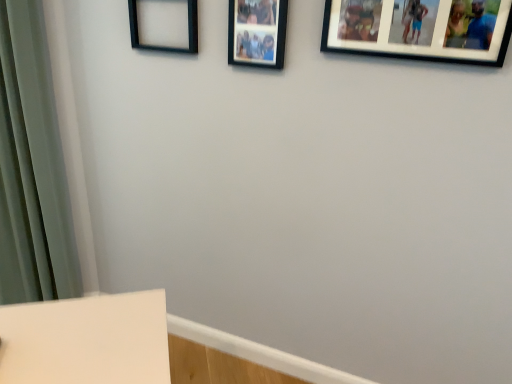
How much space does black matte picture frame at upper center, the 2th picture frame from the right, occupy horizontally?

1.53 inches.

Measure the distance between point (411, 3) and camera.

Point (411, 3) and camera are 1.23 meters apart from each other.

Find the location of a particular element. This screenshot has width=512, height=384. black matte picture frame at upper center, the second picture frame from the left is located at coordinates (257, 33).

Which is behind, point (250, 13) or point (131, 39)?

The point (131, 39) is behind.

Is black matte picture frame at upper center, the 2th picture frame from the right, far from black matte picture frame at upper left, the 3th picture frame when ordered from right to left?

That's not correct — black matte picture frame at upper center, the 2th picture frame from the right, is a little close to black matte picture frame at upper left, the 3th picture frame when ordered from right to left.

Locate an element on the screen. The width and height of the screenshot is (512, 384). picture frame on the left of the black matte picture frame at upper center, the second picture frame from the left is located at coordinates (164, 25).

From the image's perspective, is black matte picture frame at upper center, the 2th picture frame from the right, on black matte picture frame at upper left, acting as the first picture frame starting from the left?

Incorrect, from the image's perspective, black matte picture frame at upper center, the 2th picture frame from the right, is lower than black matte picture frame at upper left, acting as the first picture frame starting from the left.

Is black matte picture frame at upper left, the 3th picture frame when ordered from right to left, spatially inside black matte picture frame at upper center, the second picture frame from the left, or outside of it?

black matte picture frame at upper left, the 3th picture frame when ordered from right to left, is not enclosed by black matte picture frame at upper center, the second picture frame from the left.

Is black matte picture frame at upper left, acting as the first picture frame starting from the left, to the right of black matte picture frame at upper center, the second picture frame from the left, from the viewer's perspective?

Incorrect, black matte picture frame at upper left, acting as the first picture frame starting from the left, is not on the right side of black matte picture frame at upper center, the second picture frame from the left.

Who is more distant, black matte picture frame at upper left, acting as the first picture frame starting from the left, or black matte picture frame at upper center, the 2th picture frame from the right?

black matte picture frame at upper left, acting as the first picture frame starting from the left, is more distant.

Would you say black matte picture frame at upper left, acting as the first picture frame starting from the left, is part of black matte picture frame at upper right, the third picture frame in the left-to-right sequence,'s contents?

No, black matte picture frame at upper left, acting as the first picture frame starting from the left, is not inside black matte picture frame at upper right, the third picture frame in the left-to-right sequence.

Is black matte picture frame at upper right, the first picture frame when ordered from right to left, positioned far away from black matte picture frame at upper left, the 3th picture frame when ordered from right to left?

No, there isn't a large distance between black matte picture frame at upper right, the first picture frame when ordered from right to left, and black matte picture frame at upper left, the 3th picture frame when ordered from right to left.

Does black matte picture frame at upper right, the first picture frame when ordered from right to left, have a greater height compared to black matte picture frame at upper left, acting as the first picture frame starting from the left?

No, black matte picture frame at upper right, the first picture frame when ordered from right to left, is not taller than black matte picture frame at upper left, acting as the first picture frame starting from the left.

Consider the image. From a real-world perspective, which is physically below, black matte picture frame at upper right, the third picture frame in the left-to-right sequence, or black matte picture frame at upper left, acting as the first picture frame starting from the left?

black matte picture frame at upper left, acting as the first picture frame starting from the left, from a real-world perspective.

Is black matte picture frame at upper left, acting as the first picture frame starting from the left, beside black matte picture frame at upper right, the first picture frame when ordered from right to left?

No, black matte picture frame at upper left, acting as the first picture frame starting from the left, is not with black matte picture frame at upper right, the first picture frame when ordered from right to left.

Is black matte picture frame at upper left, acting as the first picture frame starting from the left, taller or shorter than black matte picture frame at upper right, the first picture frame when ordered from right to left?

In the image, black matte picture frame at upper left, acting as the first picture frame starting from the left, appears to be taller than black matte picture frame at upper right, the first picture frame when ordered from right to left.

At what (x,y) coordinates should I click in order to perform the action: click on the 2nd picture frame below the black matte picture frame at upper left, acting as the first picture frame starting from the left (from the image's perspective). Please return your answer as a coordinate pair (x, y). This screenshot has width=512, height=384. Looking at the image, I should click on (420, 29).

Could you tell me if black matte picture frame at upper left, acting as the first picture frame starting from the left, is facing black matte picture frame at upper right, the third picture frame in the left-to-right sequence?

No, black matte picture frame at upper left, acting as the first picture frame starting from the left, is not turned towards black matte picture frame at upper right, the third picture frame in the left-to-right sequence.

Consider the image. Is black matte picture frame at upper center, the 2th picture frame from the right, surrounding black matte picture frame at upper right, the first picture frame when ordered from right to left?

No, black matte picture frame at upper right, the first picture frame when ordered from right to left, is not a part of black matte picture frame at upper center, the 2th picture frame from the right.

Considering the sizes of objects black matte picture frame at upper center, the second picture frame from the left, and black matte picture frame at upper right, the third picture frame in the left-to-right sequence, in the image provided, who is taller, black matte picture frame at upper center, the second picture frame from the left, or black matte picture frame at upper right, the third picture frame in the left-to-right sequence,?

black matte picture frame at upper center, the second picture frame from the left, is taller.

Looking at their sizes, would you say black matte picture frame at upper center, the second picture frame from the left, is wider or thinner than black matte picture frame at upper right, the first picture frame when ordered from right to left?

black matte picture frame at upper center, the second picture frame from the left, is thinner than black matte picture frame at upper right, the first picture frame when ordered from right to left.

Are black matte picture frame at upper right, the third picture frame in the left-to-right sequence, and black matte picture frame at upper center, the second picture frame from the left, located far from each other?

No, black matte picture frame at upper right, the third picture frame in the left-to-right sequence, is in close proximity to black matte picture frame at upper center, the second picture frame from the left.

From a real-world perspective, is black matte picture frame at upper right, the third picture frame in the left-to-right sequence, physically below black matte picture frame at upper center, the 2th picture frame from the right?

Actually, black matte picture frame at upper right, the third picture frame in the left-to-right sequence, is physically above black matte picture frame at upper center, the 2th picture frame from the right, in the real world.

Considering their positions, is black matte picture frame at upper right, the first picture frame when ordered from right to left, located in front of or behind black matte picture frame at upper center, the 2th picture frame from the right?

Visually, black matte picture frame at upper right, the first picture frame when ordered from right to left, is located in front of black matte picture frame at upper center, the 2th picture frame from the right.

Considering the positions of objects black matte picture frame at upper right, the first picture frame when ordered from right to left, and black matte picture frame at upper center, the second picture frame from the left, in the image provided, who is more to the right, black matte picture frame at upper right, the first picture frame when ordered from right to left, or black matte picture frame at upper center, the second picture frame from the left,?

Positioned to the right is black matte picture frame at upper right, the first picture frame when ordered from right to left.

Locate an element on the screen. Image resolution: width=512 pixels, height=384 pixels. picture frame behind the black matte picture frame at upper center, the 2th picture frame from the right is located at coordinates (164, 25).

In the image, there is a black matte picture frame at upper center, the 2th picture frame from the right. At what (x,y) coordinates should I click in order to perform the action: click on picture frame above it (from the image's perspective). Please return your answer as a coordinate pair (x, y). Looking at the image, I should click on (164, 25).

Which object lies further to the anchor point black matte picture frame at upper right, the third picture frame in the left-to-right sequence, black matte picture frame at upper center, the 2th picture frame from the right, or black matte picture frame at upper left, acting as the first picture frame starting from the left?

black matte picture frame at upper left, acting as the first picture frame starting from the left, lies further to black matte picture frame at upper right, the third picture frame in the left-to-right sequence, than the other object.

Looking at the image, which one is located closer to black matte picture frame at upper right, the third picture frame in the left-to-right sequence, black matte picture frame at upper left, the 3th picture frame when ordered from right to left, or black matte picture frame at upper center, the 2th picture frame from the right?

black matte picture frame at upper center, the 2th picture frame from the right, is positioned closer to the anchor black matte picture frame at upper right, the third picture frame in the left-to-right sequence.

Looking at the image, which one is located further to black matte picture frame at upper center, the second picture frame from the left, black matte picture frame at upper right, the first picture frame when ordered from right to left, or black matte picture frame at upper left, acting as the first picture frame starting from the left?

Among the two, black matte picture frame at upper right, the first picture frame when ordered from right to left, is located further to black matte picture frame at upper center, the second picture frame from the left.

Considering their positions, is black matte picture frame at upper left, the 3th picture frame when ordered from right to left, positioned closer to black matte picture frame at upper center, the 2th picture frame from the right, than black matte picture frame at upper right, the third picture frame in the left-to-right sequence?

black matte picture frame at upper left, the 3th picture frame when ordered from right to left, lies closer to black matte picture frame at upper center, the 2th picture frame from the right, than the other object.

Considering their positions, is black matte picture frame at upper center, the second picture frame from the left, positioned closer to black matte picture frame at upper left, acting as the first picture frame starting from the left, than black matte picture frame at upper right, the third picture frame in the left-to-right sequence?

black matte picture frame at upper center, the second picture frame from the left, lies closer to black matte picture frame at upper left, acting as the first picture frame starting from the left, than the other object.

Estimate the real-world distances between objects in this image. Which object is closer to black matte picture frame at upper left, acting as the first picture frame starting from the left, black matte picture frame at upper right, the third picture frame in the left-to-right sequence, or black matte picture frame at upper center, the 2th picture frame from the right?

black matte picture frame at upper center, the 2th picture frame from the right, is closer to black matte picture frame at upper left, acting as the first picture frame starting from the left.

Where is `picture frame between black matte picture frame at upper left, acting as the first picture frame starting from the left, and black matte picture frame at upper right, the first picture frame when ordered from right to left, from left to right`? picture frame between black matte picture frame at upper left, acting as the first picture frame starting from the left, and black matte picture frame at upper right, the first picture frame when ordered from right to left, from left to right is located at coordinates (257, 33).